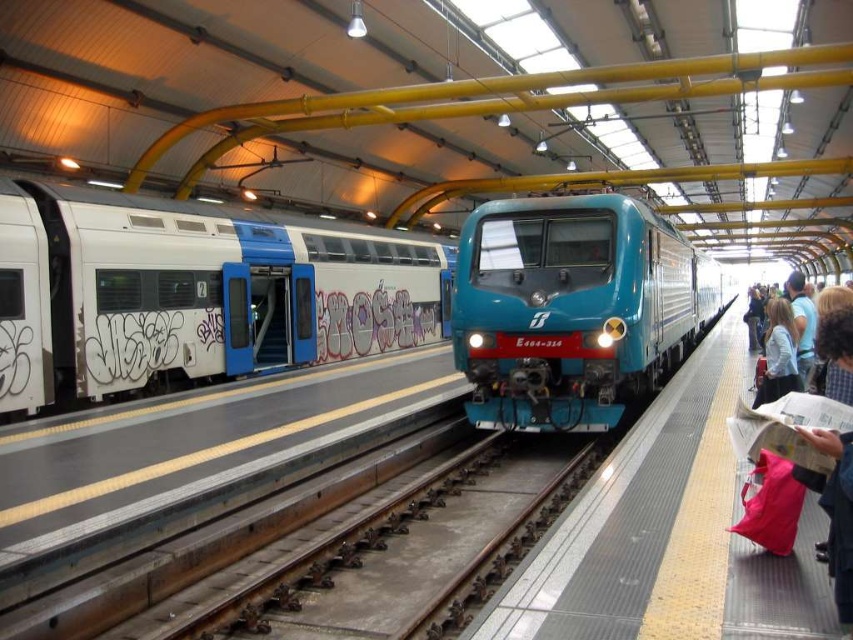
You are standing on the train station platform and see two points marked on the wall. The first point is at coordinate point (x=300, y=307) and the second is at point (x=785, y=369). Which point is closer to your eyes?

Point (x=300, y=307) is closer to your eyes because it is further to the camera than point (x=785, y=369).

You are a passenger waiting on the platform and notice two people near the blue train. One is wearing a light blue fabric jacket at right, and the other has light brown hair at right. Which of these two items is shorter?

The light blue fabric jacket at right has a lesser height compared to the light brown hair at right, so the light blue fabric jacket at right is shorter.